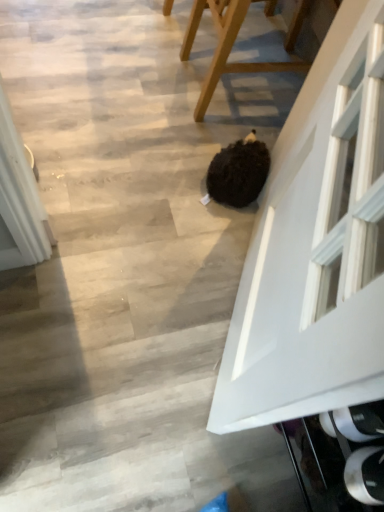
Locate an element on the screen. This screenshot has height=512, width=384. free space in front of wooden chair at center is located at coordinates (190, 142).